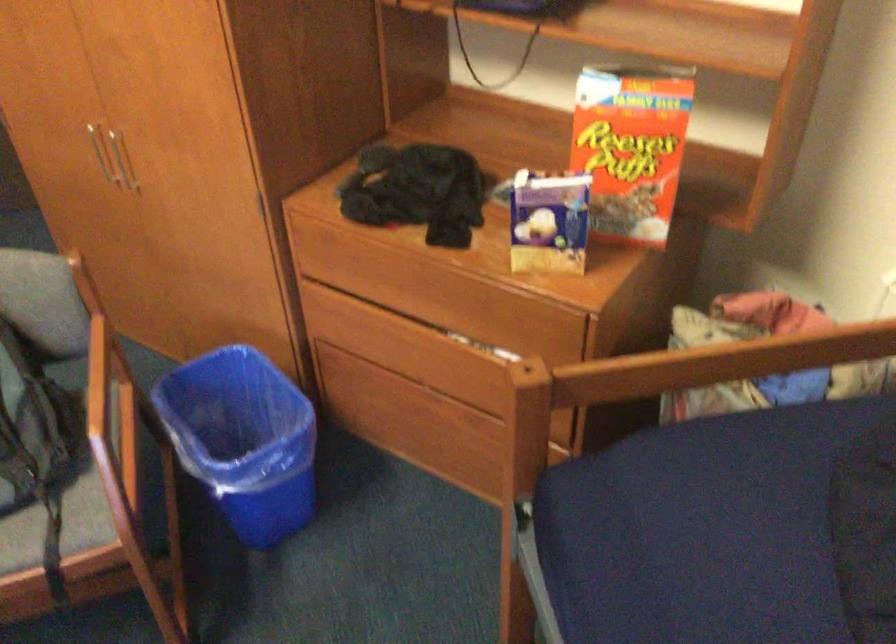
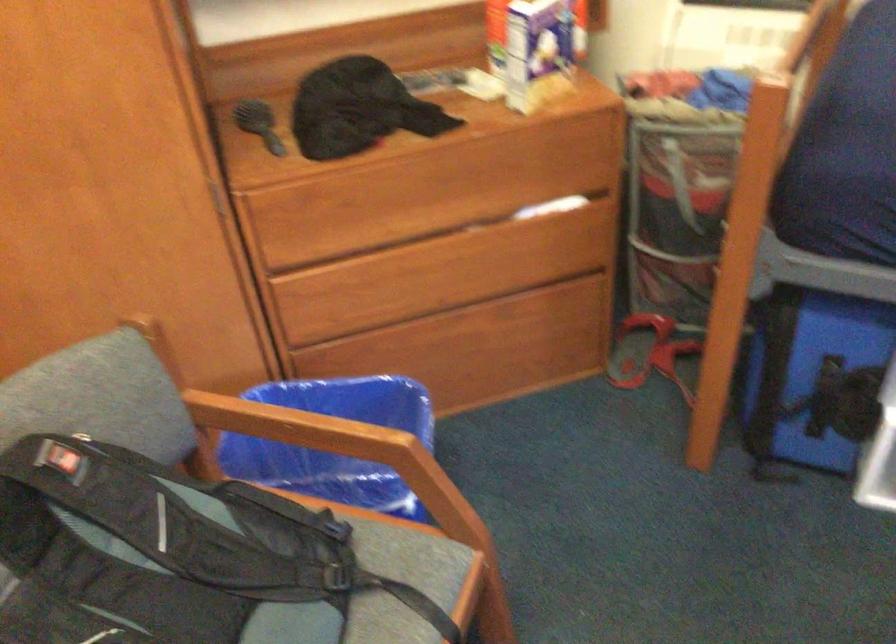
Find the pixel in the second image that matches the point at 437,400 in the first image.

(453, 319)